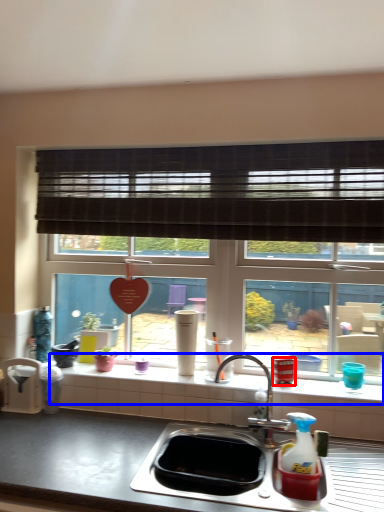
Question: Which object appears farthest to the camera in this image, appliance (highlighted by a red box) or window sill (highlighted by a blue box)?

Choices:
 (A) appliance
 (B) window sill

Answer: (A)